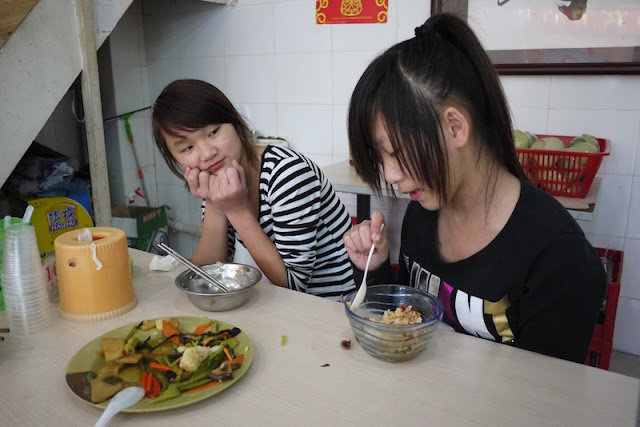
At what (x,y) coordinates should I click in order to perform the action: click on eating utensils. Please return your answer as a coordinate pair (x, y). Looking at the image, I should click on (132, 389), (200, 270), (362, 288).